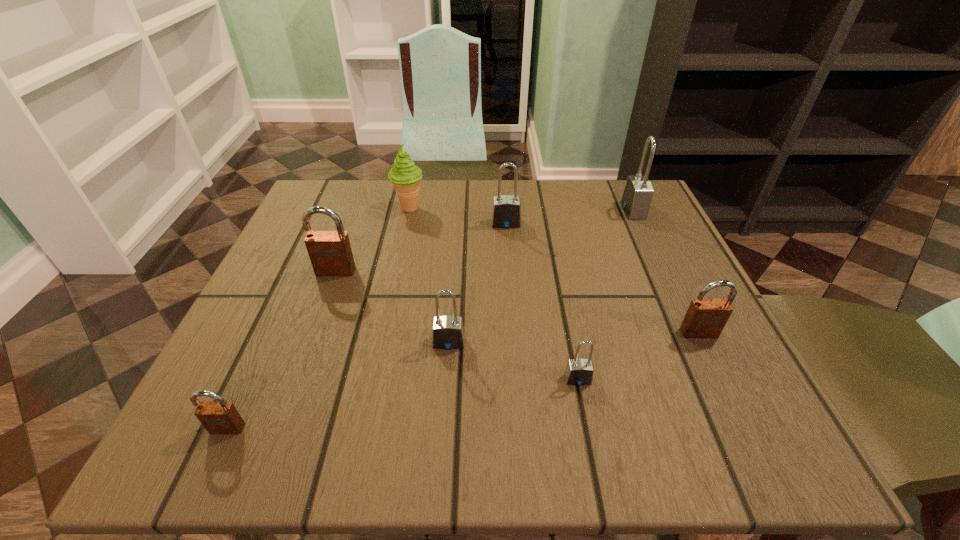
Locate an element on the screen. vacant area located on the shackle of the third smallest gray padlock is located at coordinates (511, 284).

The image size is (960, 540). I want to click on vacant space located 0.280m on the front-facing side of the third farthest padlock, so click(x=287, y=402).

You are a GUI agent. You are given a task and a screenshot of the screen. Output one action in this format:
    pyautogui.click(x=<x>, y=<y>)
    Task: Click on the free space located 0.090m on the shackle of the second smallest gray padlock
    
    Given the screenshot: What is the action you would take?
    [444, 397]

Find the location of a particular element. The width and height of the screenshot is (960, 540). free space located on the front-facing side of the second biggest brown padlock is located at coordinates (721, 378).

Where is `vacant space situated 0.110m on the shackle of the sixth farthest padlock`? Image resolution: width=960 pixels, height=540 pixels. vacant space situated 0.110m on the shackle of the sixth farthest padlock is located at coordinates (592, 455).

At what (x,y) coordinates should I click in order to perform the action: click on icecream present at the far edge. Please return your answer as a coordinate pair (x, y). Looking at the image, I should click on (405, 176).

I want to click on object situated at the near edge, so click(221, 417).

The width and height of the screenshot is (960, 540). What are the coordinates of `object positioned at the near left corner` in the screenshot? It's located at (221, 417).

In order to click on object that is at the far right corner in this screenshot , I will do `click(638, 192)`.

This screenshot has width=960, height=540. I want to click on free space at the far edge of the desktop, so click(438, 180).